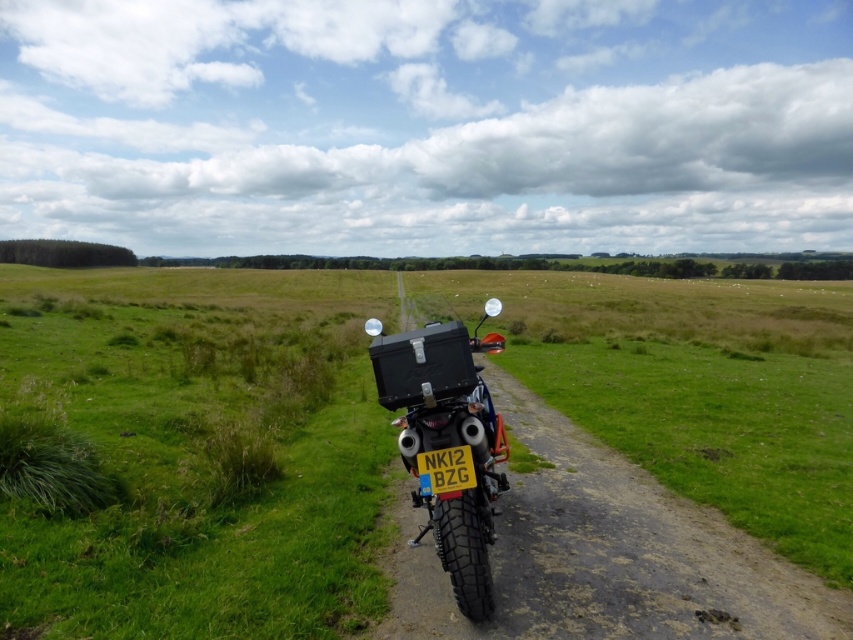
Question: Based on their relative distances, which object is farther from the matte black motorbike at center?

Choices:
 (A) black textured motorcycle at center
 (B) yellow matte license plate at center

Answer: (A)

Question: Which object is the closest to the matte black motorbike at center?

Choices:
 (A) yellow matte license plate at center
 (B) black textured motorcycle at center

Answer: (A)

Question: Is matte black motorbike at center to the left of yellow matte license plate at center from the viewer's perspective?

Choices:
 (A) yes
 (B) no

Answer: (A)

Question: Which of the following is the farthest from the observer?

Choices:
 (A) black textured motorcycle at center
 (B) matte black motorbike at center
 (C) yellow matte license plate at center

Answer: (A)

Question: Does black textured motorcycle at center appear on the right side of matte black motorbike at center?

Choices:
 (A) no
 (B) yes

Answer: (A)

Question: Is black textured motorcycle at center to the left of matte black motorbike at center from the viewer's perspective?

Choices:
 (A) yes
 (B) no

Answer: (A)